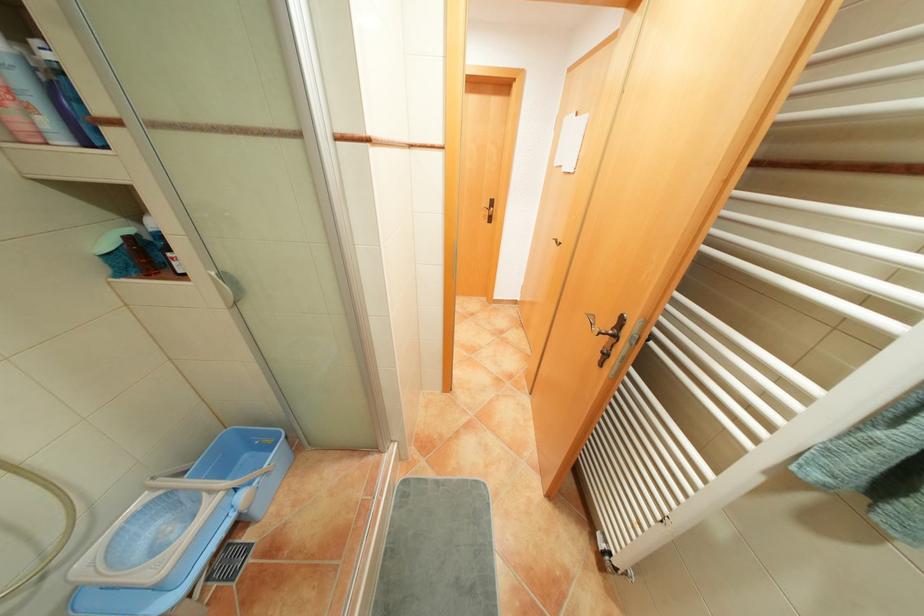
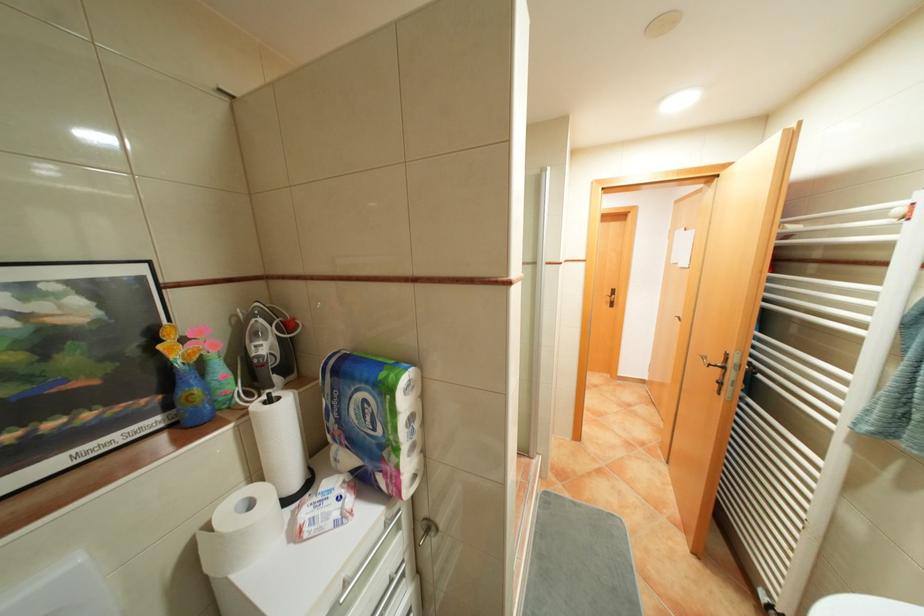
How did the camera likely rotate?

The camera's rotation is toward left-up.